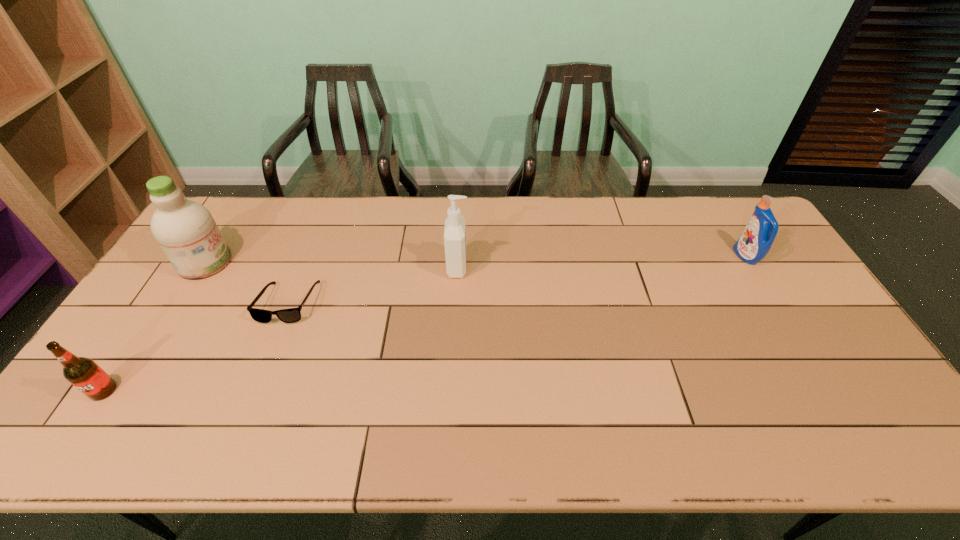
Where is `the left cleansing agent`? This screenshot has height=540, width=960. the left cleansing agent is located at coordinates (185, 230).

Where is `the right cleansing agent`? the right cleansing agent is located at coordinates (455, 225).

You are a GUI agent. You are given a task and a screenshot of the screen. Output one action in this format:
    pyautogui.click(x=<x>, y=<y>)
    Task: Click on the detergent
    The height and width of the screenshot is (540, 960).
    Given the screenshot: What is the action you would take?
    pyautogui.click(x=756, y=240)

The height and width of the screenshot is (540, 960). What are the coordinates of `root beer` in the screenshot? It's located at (82, 372).

Where is `sunglasses`? sunglasses is located at coordinates (291, 315).

Find the location of a particular element. The image size is (960, 540). the shortest object is located at coordinates (291, 315).

Where is `vacant area situated 0.330m on the front label of the left cleansing agent`? vacant area situated 0.330m on the front label of the left cleansing agent is located at coordinates (333, 262).

Locate an element on the screen. vacant space located on the front label of the fourth object from left to right is located at coordinates (532, 267).

This screenshot has width=960, height=540. What are the coordinates of `vacant space located on the label of the detergent` in the screenshot? It's located at (635, 256).

At what (x,y) coordinates should I click in order to perform the action: click on blank area located 0.220m on the label of the detergent. Please return your answer as a coordinate pair (x, y). The width and height of the screenshot is (960, 540). Looking at the image, I should click on (668, 256).